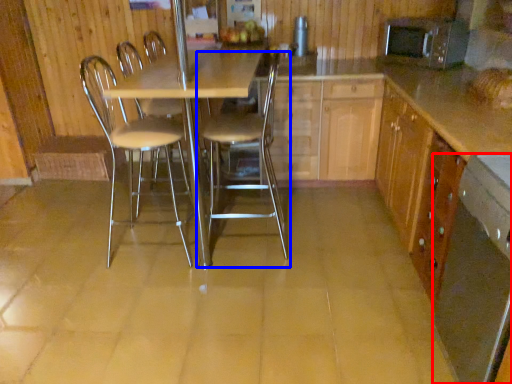
Question: Which point is closer to the camera, kitchen appliance (highlighted by a red box) or chair (highlighted by a blue box)?

Choices:
 (A) kitchen appliance
 (B) chair

Answer: (A)